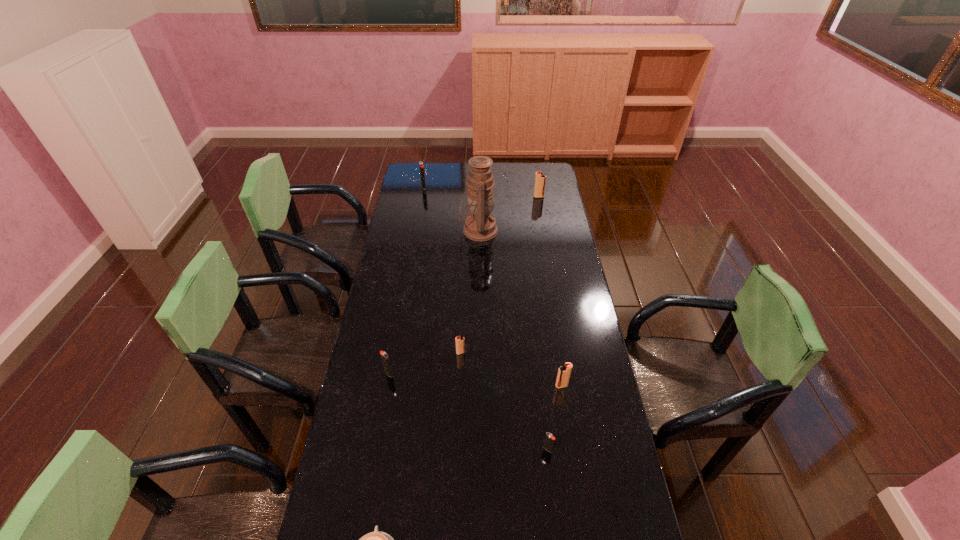
At what (x,y) coordinates should I click in order to perform the action: click on the third farthest object. Please return your answer as a coordinate pair (x, y). Image resolution: width=960 pixels, height=540 pixels. Looking at the image, I should click on (479, 226).

Identify the location of the tallest object. This screenshot has height=540, width=960. (479, 226).

Find the location of `the fifth nearest igniter`. the fifth nearest igniter is located at coordinates (540, 179).

You are a GUI agent. You are given a task and a screenshot of the screen. Output one action in this format:
    pyautogui.click(x=<x>, y=<y>)
    Task: Click on the biggest red igniter
    The height and width of the screenshot is (540, 960).
    Given the screenshot: What is the action you would take?
    pyautogui.click(x=540, y=179)

I want to click on the farthest black igniter, so (421, 165).

Identify the location of the biggest black igniter. The height and width of the screenshot is (540, 960). (421, 165).

The width and height of the screenshot is (960, 540). Identify the location of the second smallest black igniter. (385, 360).

You are a GUI agent. You are given a task and a screenshot of the screen. Output one action in this format:
    pyautogui.click(x=<x>, y=<y>)
    Task: Click on the fourth nearest object
    
    Given the screenshot: What is the action you would take?
    pyautogui.click(x=385, y=360)

I want to click on the second biggest red igniter, so click(564, 372).

The image size is (960, 540). In order to click on the nearest red igniter in this screenshot , I will do [564, 372].